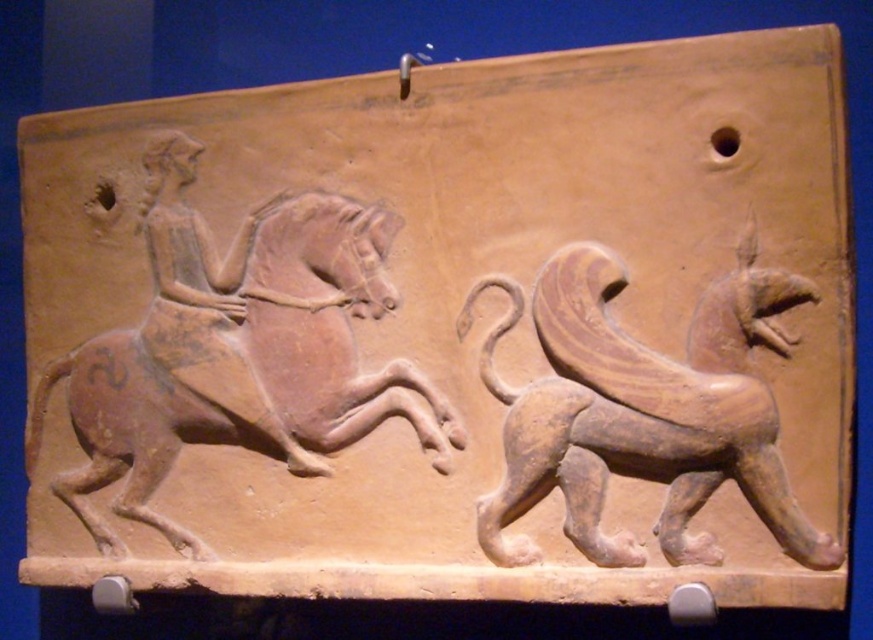
Question: Which point is closer to the camera?

Choices:
 (A) (184, 305)
 (B) (492, 518)

Answer: (B)

Question: Does earthenware horse at left appear on the right side of brown clay lion at right?

Choices:
 (A) yes
 (B) no

Answer: (B)

Question: Which of the following is the closest to the observer?

Choices:
 (A) earthenware horse at left
 (B) brown clay lion at right

Answer: (B)

Question: Can you confirm if earthenware horse at left is bigger than brown clay lion at right?

Choices:
 (A) yes
 (B) no

Answer: (A)

Question: Is earthenware horse at left below brown clay lion at right?

Choices:
 (A) yes
 (B) no

Answer: (B)

Question: Which of the following is the closest to the observer?

Choices:
 (A) brown clay lion at right
 (B) earthenware horse at left

Answer: (A)